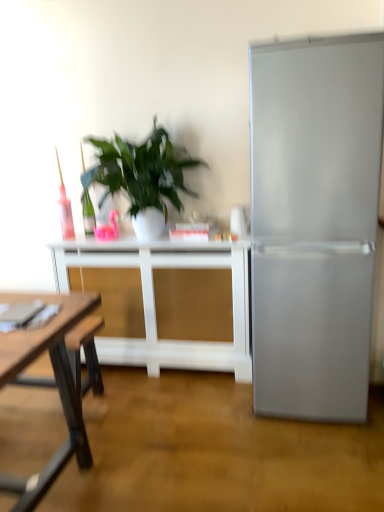
Describe the element at coordinates (143, 177) in the screenshot. This screenshot has height=512, width=384. I see `green leafy plant at center` at that location.

What are the coordinates of `white matte table at center` in the screenshot? It's located at [x=155, y=303].

Is satin silver refrigerator at right bigger or smaller than green leafy plant at center?

A: Clearly, satin silver refrigerator at right is larger in size than green leafy plant at center.

From a real-world perspective, does satin silver refrigerator at right sit lower than green leafy plant at center?

Yes, from a real-world perspective, satin silver refrigerator at right is below green leafy plant at center.

From the image's perspective, is satin silver refrigerator at right below green leafy plant at center?

Indeed, from the image's perspective, satin silver refrigerator at right is shown beneath green leafy plant at center.

From a real-world perspective, who is located higher, white matte table at center or satin silver refrigerator at right?

satin silver refrigerator at right is physically above.

Which is less distant, (103, 358) or (361, 99)?

The point (361, 99) is more forward.

Is white matte table at center next to satin silver refrigerator at right and touching it?

They are not placed beside each other.

Considering the sizes of objects white matte table at center and satin silver refrigerator at right in the image provided, who is thinner, white matte table at center or satin silver refrigerator at right?

white matte table at center is thinner.

In the scene shown: Is white matte table at center closer to the viewer compared to green leafy plant at center?

No.

Can you confirm if white matte table at center is wider than green leafy plant at center?

No.

Is point (84, 239) closer or farther from the camera than point (135, 174)?

Point (84, 239) appears to be farther away from the viewer than point (135, 174).

Is green leafy plant at center at the back of white matte table at center?

No.

Which of these two, green leafy plant at center or satin silver refrigerator at right, stands shorter?

Standing shorter between the two is green leafy plant at center.

From the picture: Measure the distance between green leafy plant at center and satin silver refrigerator at right.

They are 32.32 inches apart.

Is green leafy plant at center beside satin silver refrigerator at right?

green leafy plant at center is not next to satin silver refrigerator at right, and they're not touching.

The height and width of the screenshot is (512, 384). Find the location of `houseplant on the left side of satin silver refrigerator at right`. houseplant on the left side of satin silver refrigerator at right is located at coordinates (143, 177).

From the picture: Can you tell me how much satin silver refrigerator at right and white matte table at center differ in facing direction?

The facing directions of satin silver refrigerator at right and white matte table at center are 3.77e-05 degrees apart.

Which point is more forward, [255,118] or [218,370]?

The point [255,118] is more forward.

The image size is (384, 512). I want to click on refrigerator above the white matte table at center (from a real-world perspective), so click(314, 222).

Is satin silver refrigerator at right to the left of white matte table at center from the viewer's perspective?

Incorrect, satin silver refrigerator at right is not on the left side of white matte table at center.

Can you confirm if green leafy plant at center is positioned to the left of white matte table at center?

Yes, green leafy plant at center is to the left of white matte table at center.

From the image's perspective, is green leafy plant at center above or below white matte table at center?

green leafy plant at center is situated higher than white matte table at center in the image.

Is green leafy plant at center shorter than white matte table at center?

Yes, green leafy plant at center is shorter than white matte table at center.

Which is closer to the camera, (x=162, y=151) or (x=243, y=327)?

The point (x=162, y=151) is closer.

At what (x,y) coordinates should I click in order to perform the action: click on houseplant that appears above the satin silver refrigerator at right (from the image's perspective). Please return your answer as a coordinate pair (x, y). This screenshot has width=384, height=512. Looking at the image, I should click on (143, 177).

Identify the location of table to the left of satin silver refrigerator at right. (155, 303).

From the image, which object appears to be nearer to green leafy plant at center, white matte table at center or satin silver refrigerator at right?

Based on the image, white matte table at center appears to be nearer to green leafy plant at center.

Which object lies nearer to the anchor point satin silver refrigerator at right, green leafy plant at center or white matte table at center?

Based on the image, white matte table at center appears to be nearer to satin silver refrigerator at right.

Considering their positions, is green leafy plant at center positioned further to white matte table at center than satin silver refrigerator at right?

The object further to white matte table at center is satin silver refrigerator at right.

Considering their positions, is satin silver refrigerator at right positioned further to white matte table at center than green leafy plant at center?

satin silver refrigerator at right.

Considering their positions, is satin silver refrigerator at right positioned closer to green leafy plant at center than white matte table at center?

white matte table at center lies closer to green leafy plant at center than the other object.

Considering their positions, is white matte table at center positioned further to satin silver refrigerator at right than green leafy plant at center?

Based on the image, green leafy plant at center appears to be further to satin silver refrigerator at right.

Locate an element on the screen. The image size is (384, 512). table between green leafy plant at center and satin silver refrigerator at right in the horizontal direction is located at coordinates (155, 303).